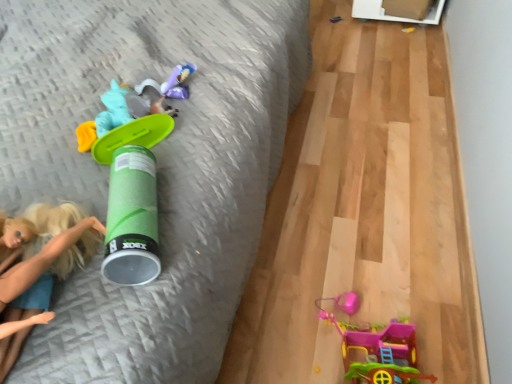
Question: Considering the relative sizes of green matte canister at center, placed as the third toy when sorted from right to left, and plastic pink toy house at lower right, which ranks as the first toy in bottom-to-top order, in the image provided, is green matte canister at center, placed as the third toy when sorted from right to left, wider than plastic pink toy house at lower right, which ranks as the first toy in bottom-to-top order,?

Choices:
 (A) no
 (B) yes

Answer: (B)

Question: Can we say green matte canister at center, acting as the first toy starting from the front, lies outside plastic pink toy house at lower right, the 2th toy in the front-to-back sequence?

Choices:
 (A) no
 (B) yes

Answer: (B)

Question: Does green matte canister at center, which is the third toy in left-to-right order, come behind plastic pink toy house at lower right, positioned as the 2th toy in right-to-left order?

Choices:
 (A) yes
 (B) no

Answer: (B)

Question: Is plastic pink toy house at lower right, which is the fifth toy in top-to-bottom order, located within green matte canister at center, positioned as the fourth toy in top-to-bottom order?

Choices:
 (A) yes
 (B) no

Answer: (B)

Question: Does green matte canister at center, positioned as the fourth toy in top-to-bottom order, have a lesser height compared to plastic pink toy house at lower right, positioned as the 2th toy in right-to-left order?

Choices:
 (A) yes
 (B) no

Answer: (A)

Question: From a real-world perspective, is green matte canister at center, which is the second toy in bottom-to-top order, physically above plastic pink toy house at lower right, positioned as the 2th toy in right-to-left order?

Choices:
 (A) no
 (B) yes

Answer: (B)

Question: Considering the relative sizes of green matte canister at center, acting as the first toy starting from the front, and metallic silver toy at upper right, marked as the fifth toy in a front-to-back arrangement, in the image provided, is green matte canister at center, acting as the first toy starting from the front, taller than metallic silver toy at upper right, marked as the fifth toy in a front-to-back arrangement,?

Choices:
 (A) no
 (B) yes

Answer: (B)

Question: Can you confirm if green matte canister at center, which is the third toy in left-to-right order, is positioned to the right of metallic silver toy at upper right, the first toy when ordered from right to left?

Choices:
 (A) no
 (B) yes

Answer: (A)

Question: Does green matte canister at center, which is the third toy in left-to-right order, have a smaller size compared to metallic silver toy at upper right, acting as the 5th toy starting from the left?

Choices:
 (A) yes
 (B) no

Answer: (B)

Question: Is green matte canister at center, which is the third toy in left-to-right order, behind metallic silver toy at upper right, which appears as the 5th toy when ordered from the bottom?

Choices:
 (A) no
 (B) yes

Answer: (A)

Question: Would you say metallic silver toy at upper right, which appears as the 1th toy when viewed from the top, is part of green matte canister at center, placed as the third toy when sorted from right to left,'s contents?

Choices:
 (A) yes
 (B) no

Answer: (B)

Question: Is green matte canister at center, which is the third toy in left-to-right order, in front of metallic silver toy at upper right, which appears as the 1th toy when viewed from the top?

Choices:
 (A) no
 (B) yes

Answer: (B)

Question: Is plastic pink toy house at lower right, positioned as the 2th toy in right-to-left order, further to camera compared to green plastic toy at upper left, which ranks as the 3th toy in front-to-back order?

Choices:
 (A) yes
 (B) no

Answer: (B)